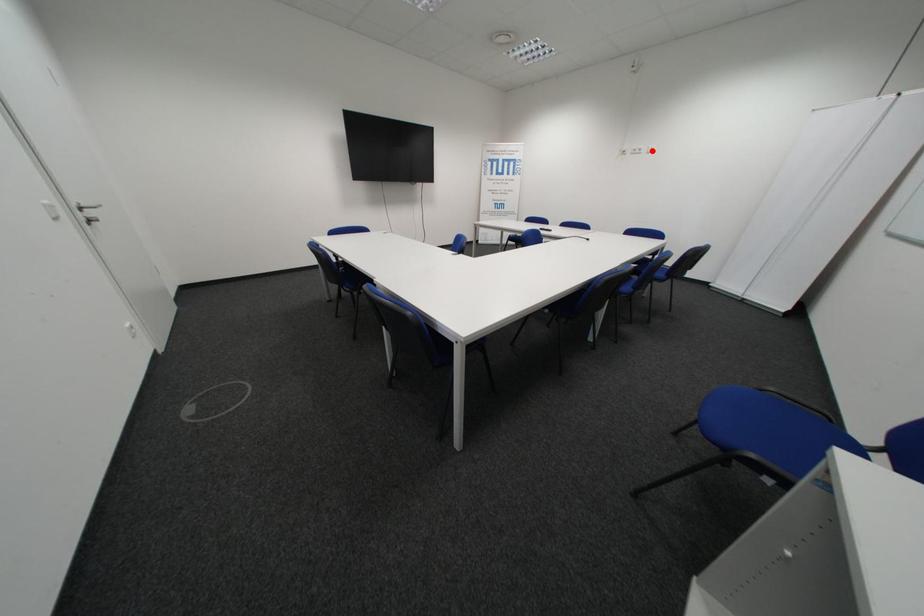
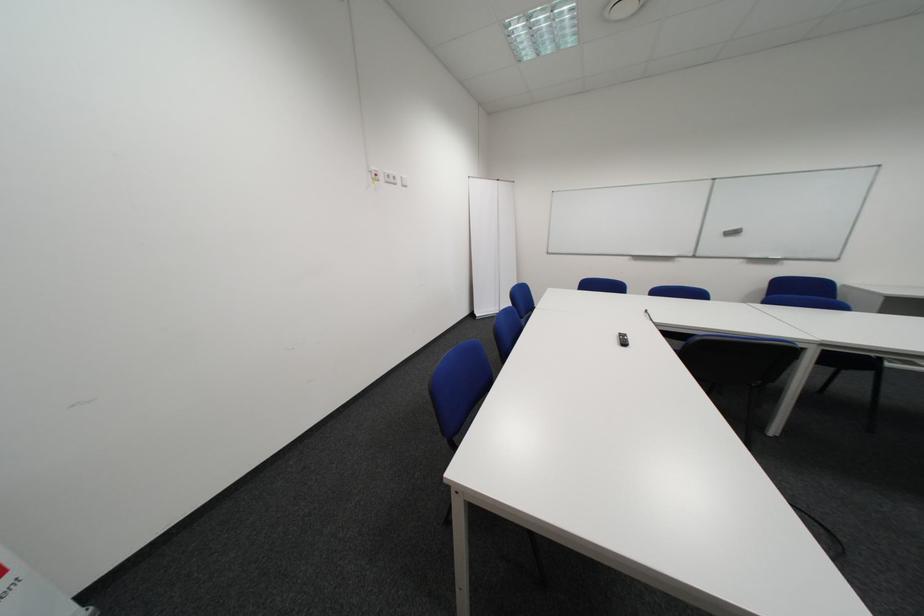
Where in the second image is the point corresponding to the highlighted location from the first image?

(407, 179)